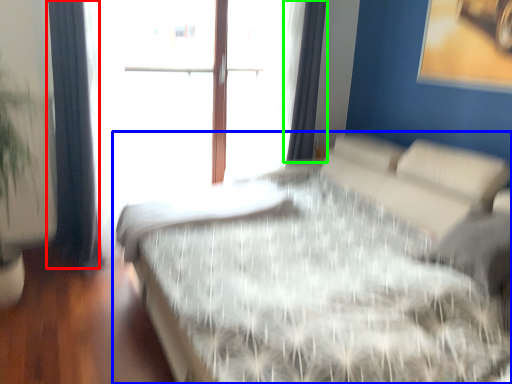
Question: Considering the real-world distances, which object is closest to curtain (highlighted by a red box)? bed (highlighted by a blue box) or curtain (highlighted by a green box).

Choices:
 (A) bed
 (B) curtain

Answer: (A)